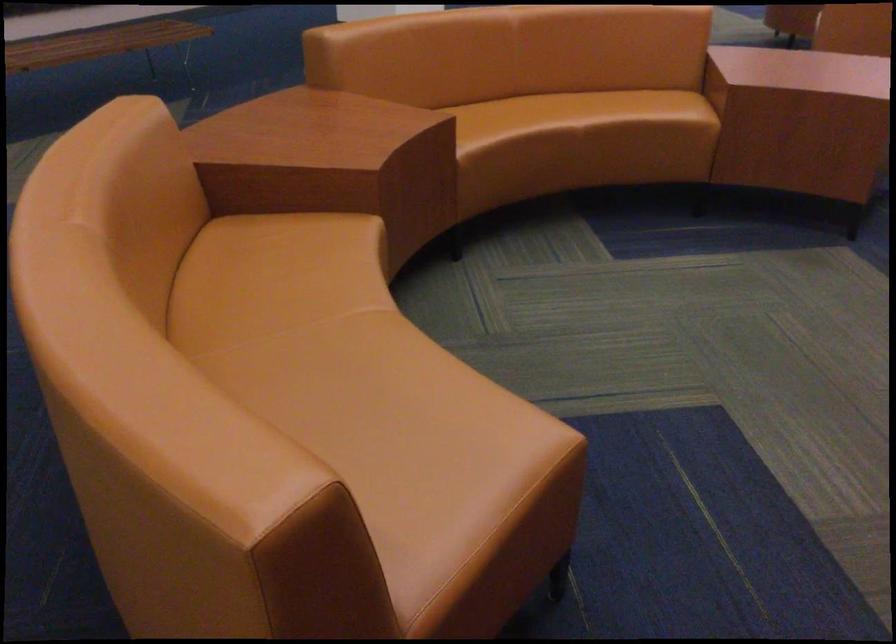
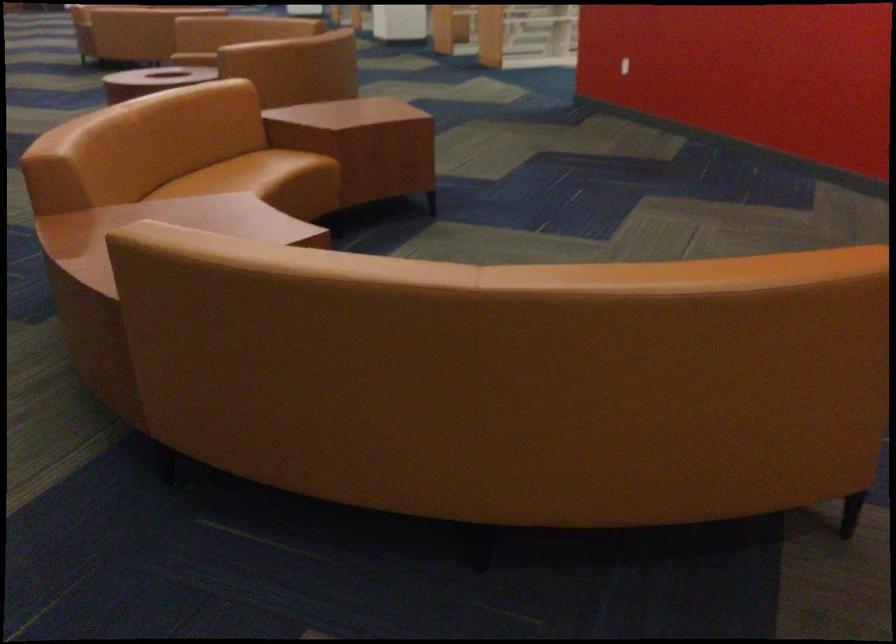
In the second image, find the point that corresponds to pixel 593 100 in the first image.

(236, 174)